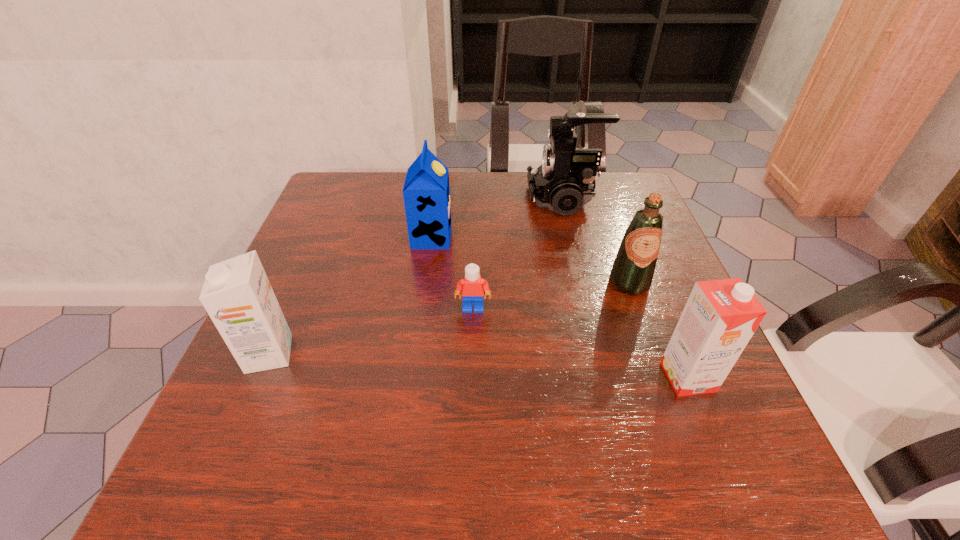
Identify which object is the closest to the olive oil. Please provide its 2D coordinates. Your answer should be formatted as a tuple, i.e. [(x, y)], where the tuple contains the x and y coordinates of a point satisfying the conditions above.

[(720, 317)]

Locate which carton is the closest to the rightmost carton. Please provide its 2D coordinates. Your answer should be formatted as a tuple, i.e. [(x, y)], where the tuple contains the x and y coordinates of a point satisfying the conditions above.

[(426, 192)]

Identify which carton is the second nearest to the leftmost object. Please provide its 2D coordinates. Your answer should be formatted as a tuple, i.e. [(x, y)], where the tuple contains the x and y coordinates of a point satisfying the conditions above.

[(720, 317)]

At what (x,y) coordinates should I click in order to perform the action: click on free location that satisfies the following two spatial constraints: 1. with the cap open on the second carton from left to right; 2. on the back side of the rightmost carton. Please return your answer as a coordinate pair (x, y). The width and height of the screenshot is (960, 540). Looking at the image, I should click on (414, 377).

At what (x,y) coordinates should I click in order to perform the action: click on free space that satisfies the following two spatial constraints: 1. on the front side of the rightmost carton; 2. on the right side of the leftmost carton. Please return your answer as a coordinate pair (x, y). The image size is (960, 540). Looking at the image, I should click on (259, 377).

Locate an element on the screen. Image resolution: width=960 pixels, height=540 pixels. vacant space that satisfies the following two spatial constraints: 1. on the lens mount of the farthest object; 2. on the front side of the leftmost object is located at coordinates (603, 354).

Where is `vacant region that satisfies the following two spatial constraints: 1. on the lens mount of the camcorder; 2. on the back side of the rightmost carton`? The image size is (960, 540). vacant region that satisfies the following two spatial constraints: 1. on the lens mount of the camcorder; 2. on the back side of the rightmost carton is located at coordinates (610, 377).

At what (x,y) coordinates should I click in order to perform the action: click on vacant point that satisfies the following two spatial constraints: 1. on the lens mount of the farthest object; 2. on the front side of the leftmost object. Please return your answer as a coordinate pair (x, y). Looking at the image, I should click on click(603, 354).